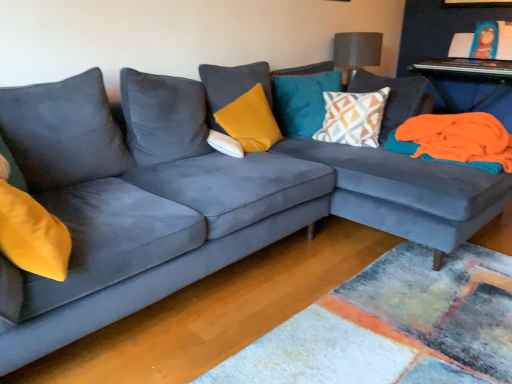
Question: Is point (432, 64) positioned closer to the camera than point (348, 79)?

Choices:
 (A) farther
 (B) closer

Answer: (A)

Question: From a real-world perspective, relative to textured gray lampshade at upper center, is orange fabric at right, positioned as the 2th table in top-to-bottom order, vertically above or below?

Choices:
 (A) above
 (B) below

Answer: (B)

Question: Based on their relative distances, which object is farther from the textured gray lampshade at upper center?

Choices:
 (A) teal velvet pillow at upper center, the third pillow viewed from the left
 (B) orange fleece blanket at right
 (C) metallic silver keyboard at upper right, which ranks as the 2th table in bottom-to-top order
 (D) white soft pillow at center, placed as the fourth pillow when sorted from right to left
 (E) orange fabric at right, positioned as the 2th table in top-to-bottom order

Answer: (D)

Question: Which of these objects is positioned farthest from the teal velvet pillow at upper center, the third pillow viewed from the left?

Choices:
 (A) orange fabric at right, positioned as the 2th table in top-to-bottom order
 (B) geometric-patterned fabric pillow at center, placed as the first pillow when sorted from right to left
 (C) white soft pillow at center, placed as the fourth pillow when sorted from right to left
 (D) metallic silver keyboard at upper right, the 1th table viewed from the top
 (E) textured gray lampshade at upper center

Answer: (A)